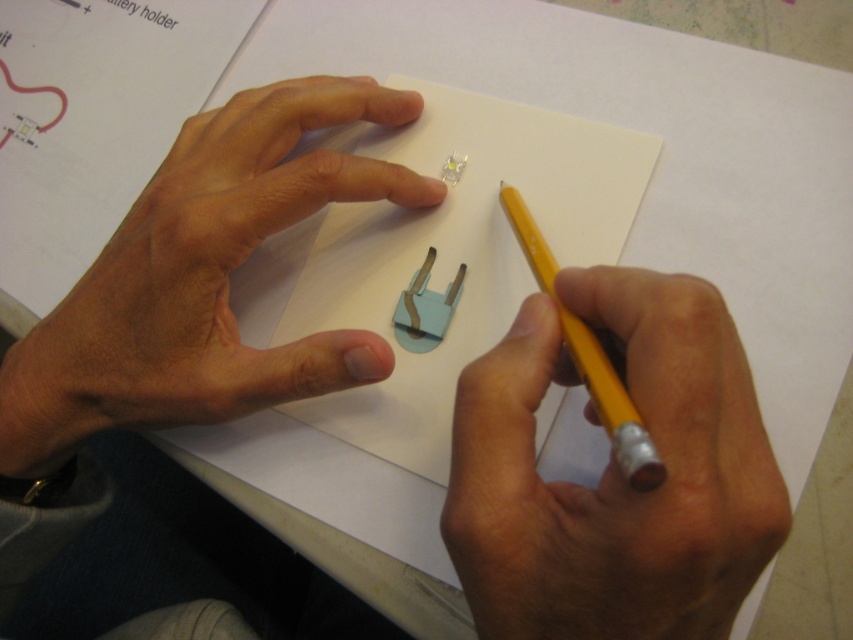
Question: Based on their relative distances, which object is nearer to the yellow wood pencil at center?

Choices:
 (A) dry skin at upper left
 (B) yellow wood pencil at right

Answer: (B)

Question: Is yellow wood pencil at center to the right of dry skin at upper left from the viewer's perspective?

Choices:
 (A) no
 (B) yes

Answer: (B)

Question: Which object is positioned closest to the dry skin at upper left?

Choices:
 (A) yellow wood pencil at right
 (B) yellow wood pencil at center

Answer: (B)

Question: Which point is farther to the camera?

Choices:
 (A) (529, 483)
 (B) (39, 397)
 (C) (595, 374)

Answer: (B)

Question: Is yellow wood pencil at center above yellow wood pencil at right?

Choices:
 (A) yes
 (B) no

Answer: (B)

Question: Does dry skin at upper left have a lesser width compared to yellow wood pencil at right?

Choices:
 (A) no
 (B) yes

Answer: (A)